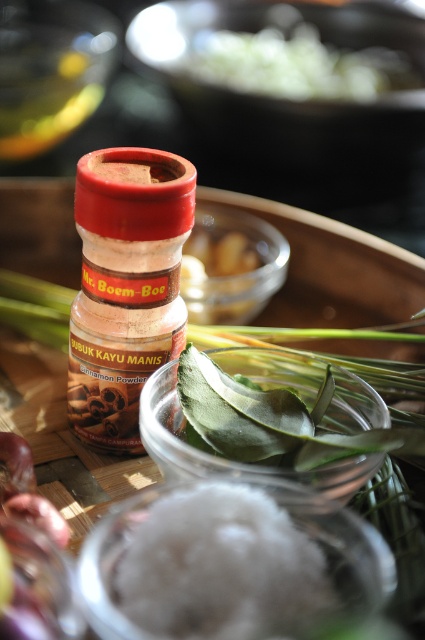
Can you confirm if white fluffy powder at center is positioned to the right of green leafy at center?

No, white fluffy powder at center is not to the right of green leafy at center.

The height and width of the screenshot is (640, 425). What do you see at coordinates (221, 566) in the screenshot?
I see `white fluffy powder at center` at bounding box center [221, 566].

The width and height of the screenshot is (425, 640). I want to click on white fluffy powder at center, so click(x=221, y=566).

Is green leafy at center positioned behind green leafy vegetable at upper center?

No.

The width and height of the screenshot is (425, 640). Identify the location of green leafy at center. (266, 419).

Locate an element on the screen. green leafy at center is located at coordinates (266, 419).

What do you see at coordinates (221, 566) in the screenshot? The height and width of the screenshot is (640, 425). I see `white fluffy powder at center` at bounding box center [221, 566].

The width and height of the screenshot is (425, 640). What are the coordinates of `white fluffy powder at center` in the screenshot? It's located at (221, 566).

Locate an element on the screen. This screenshot has width=425, height=640. white fluffy powder at center is located at coordinates (221, 566).